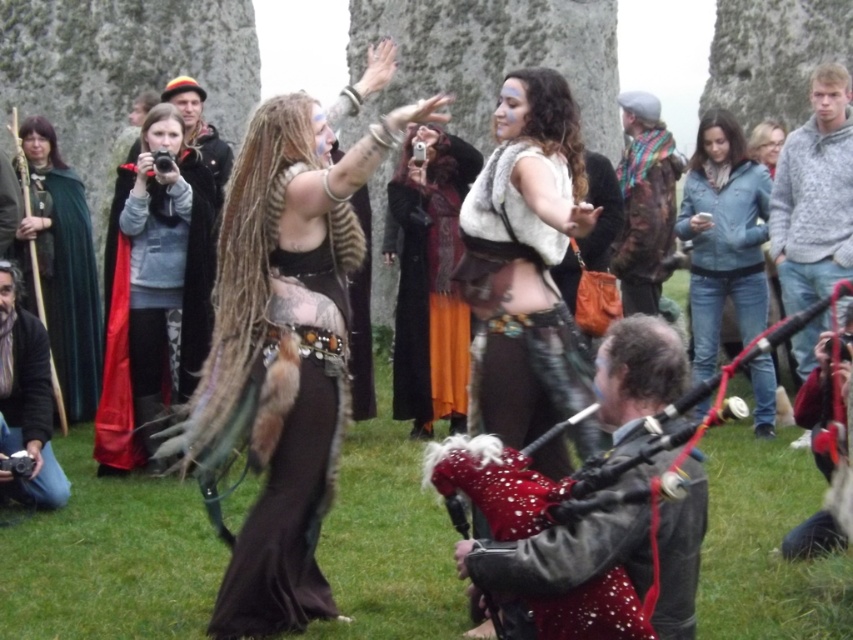
In the scene shown: You are a photographer at the event and want to capture both the shiny silver vest at center and the camouflage jacket at center in a single frame. Which clothing item should you focus on first to ensure both are in the shot?

The shiny silver vest at center is taller than the camouflage jacket at center, so focusing on the shiny silver vest at center first will help ensure both are in the frame.

You are a photographer standing at the camera position. You want to take a photo of the gray knitted sweater at right. Is the sweater within your camera lens range? The camera can capture objects up to 200 feet away.

The gray knitted sweater at right is 220.52 feet away from the camera, which exceeds the camera lens range of 200 feet. Therefore, the sweater is out of range and cannot be captured clearly.